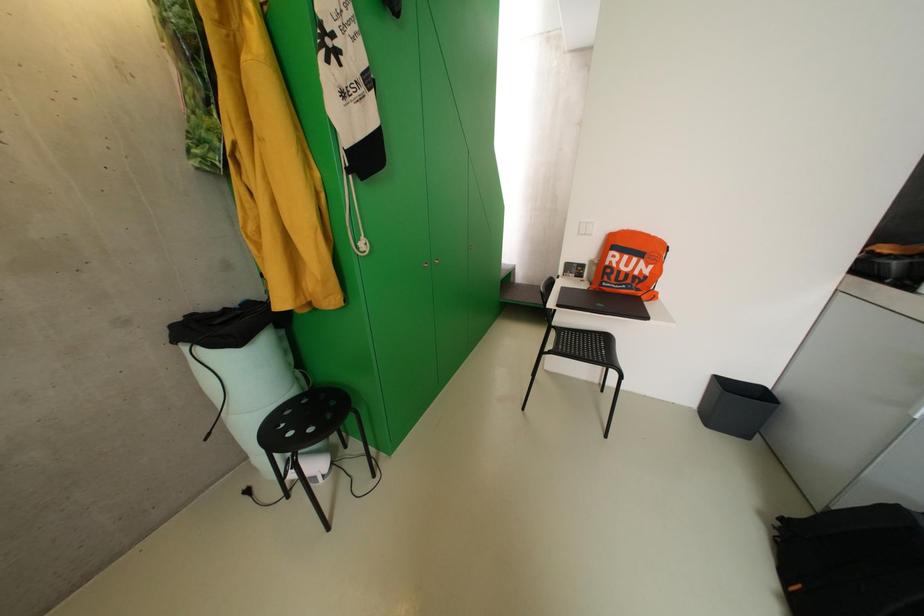
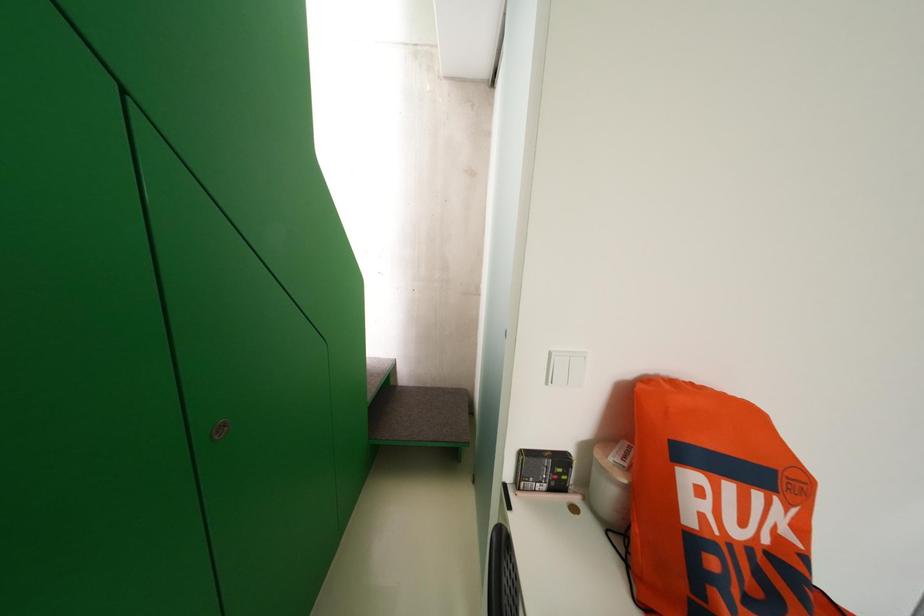
Question: What movement of the cameraman would produce the second image?

Choices:
 (A) Left
 (B) Right
 (C) Forward
 (D) Backward

Answer: (C)